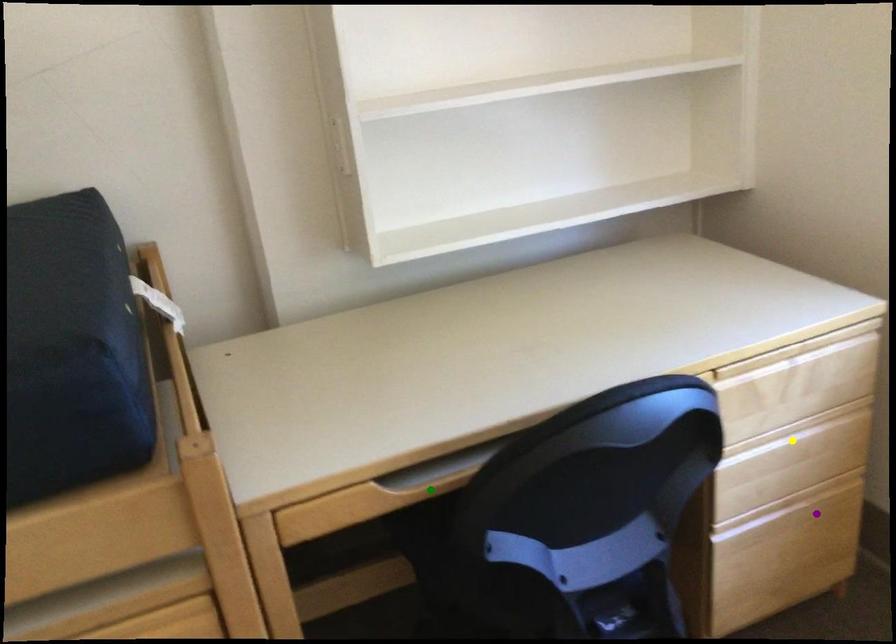
Order these from farthest to nearest:
green point
purple point
yellow point

1. purple point
2. yellow point
3. green point